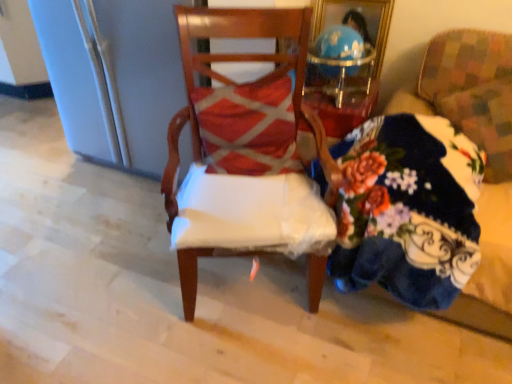
Question: Could you tell me if floral-patterned fabric at right, the first chair when ordered from right to left, is turned towards textured red pillow at center?

Choices:
 (A) yes
 (B) no

Answer: (B)

Question: Is floral-patterned fabric at right, the first chair when ordered from right to left, beside textured red pillow at center?

Choices:
 (A) yes
 (B) no

Answer: (B)

Question: Does floral-patterned fabric at right, the first chair when ordered from right to left, appear on the right side of textured red pillow at center?

Choices:
 (A) no
 (B) yes

Answer: (B)

Question: Is floral-patterned fabric at right, which is the second chair from left to right, not close to textured red pillow at center?

Choices:
 (A) yes
 (B) no

Answer: (B)

Question: Is floral-patterned fabric at right, which is the second chair from left to right, smaller than textured red pillow at center?

Choices:
 (A) yes
 (B) no

Answer: (B)

Question: From the image's perspective, does floral-patterned fabric at right, which is the second chair from left to right, appear lower than textured red pillow at center?

Choices:
 (A) no
 (B) yes

Answer: (B)

Question: Is floral fabric couch at right positioned in front of floral-patterned fabric at right, which is the second chair from left to right?

Choices:
 (A) yes
 (B) no

Answer: (A)

Question: From the image's perspective, would you say floral fabric couch at right is shown under floral-patterned fabric at right, the first chair when ordered from right to left?

Choices:
 (A) no
 (B) yes

Answer: (B)

Question: From the image's perspective, is floral fabric couch at right located above floral-patterned fabric at right, which is the second chair from left to right?

Choices:
 (A) yes
 (B) no

Answer: (B)

Question: Would you say floral fabric couch at right is outside floral-patterned fabric at right, the first chair when ordered from right to left?

Choices:
 (A) yes
 (B) no

Answer: (A)

Question: Could you tell me if floral fabric couch at right is facing floral-patterned fabric at right, the first chair when ordered from right to left?

Choices:
 (A) yes
 (B) no

Answer: (A)

Question: Is floral fabric couch at right to the left of floral-patterned fabric at right, the first chair when ordered from right to left, from the viewer's perspective?

Choices:
 (A) yes
 (B) no

Answer: (A)

Question: From the image's perspective, would you say wooden chair at center, the first chair from the left, is shown under floral-patterned fabric at right, which is the second chair from left to right?

Choices:
 (A) yes
 (B) no

Answer: (A)